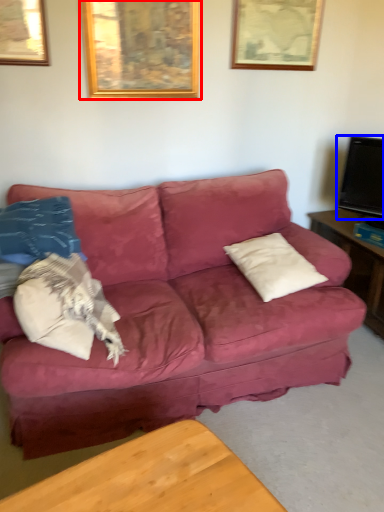
Question: Which object is further to the camera taking this photo, picture frame (highlighted by a red box) or television (highlighted by a blue box)?

Choices:
 (A) picture frame
 (B) television

Answer: (B)